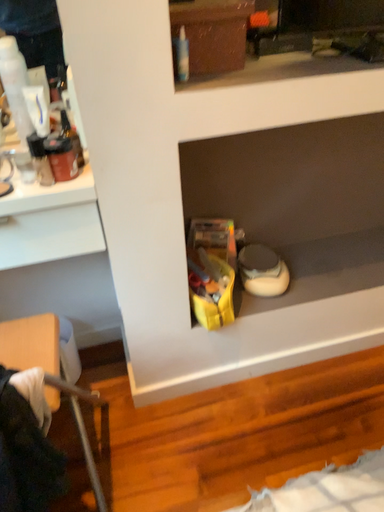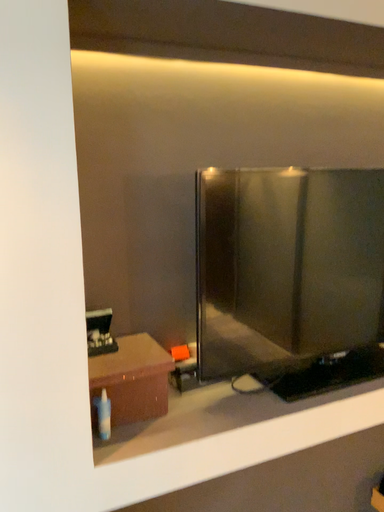
Question: Which way did the camera rotate in the video?

Choices:
 (A) rotated right
 (B) rotated left

Answer: (A)